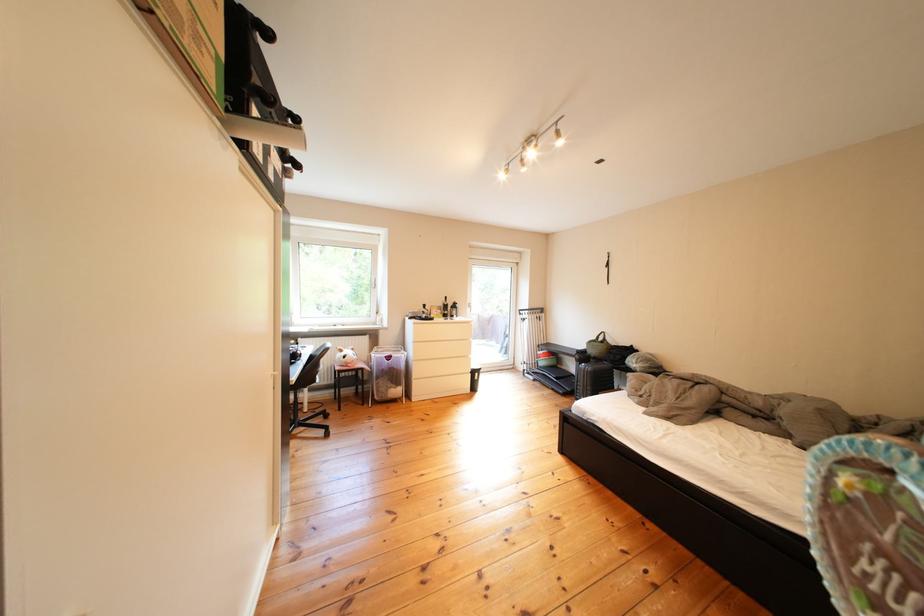
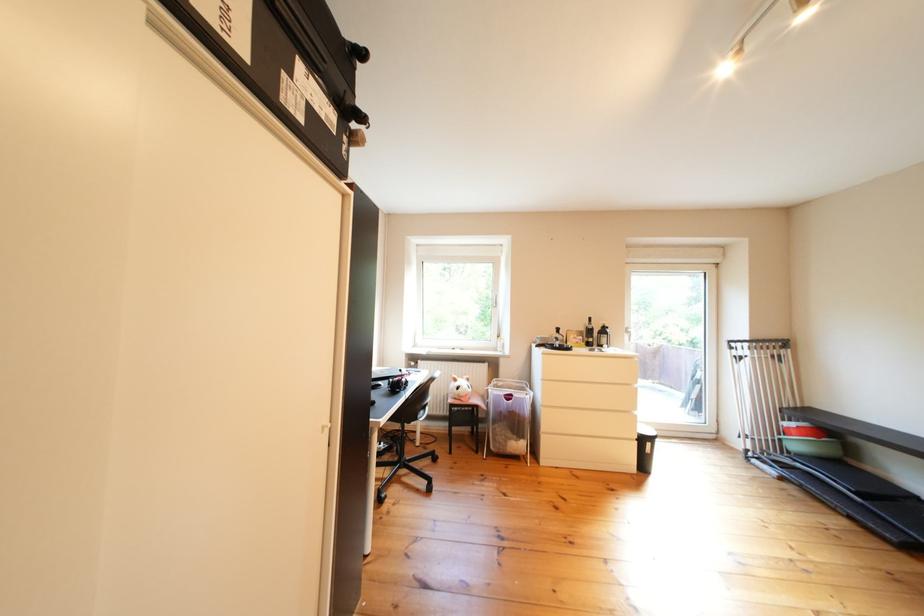
Question: The camera is either moving clockwise (left) or counter-clockwise (right) around the object. The first image is from the beginning of the video and the second image is from the end. Is the camera moving left or right when shooting the video?

Choices:
 (A) Left
 (B) Right

Answer: (B)